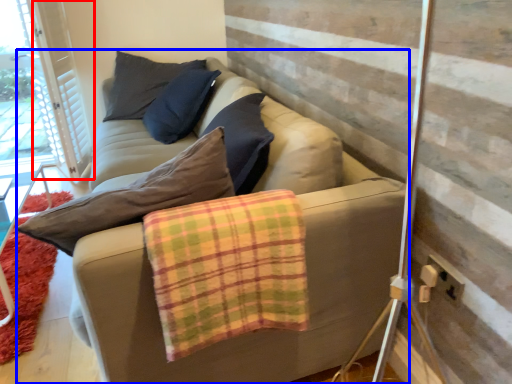
Question: Which object is closer to the camera taking this photo, barn door (highlighted by a red box) or studio couch (highlighted by a blue box)?

Choices:
 (A) barn door
 (B) studio couch

Answer: (B)